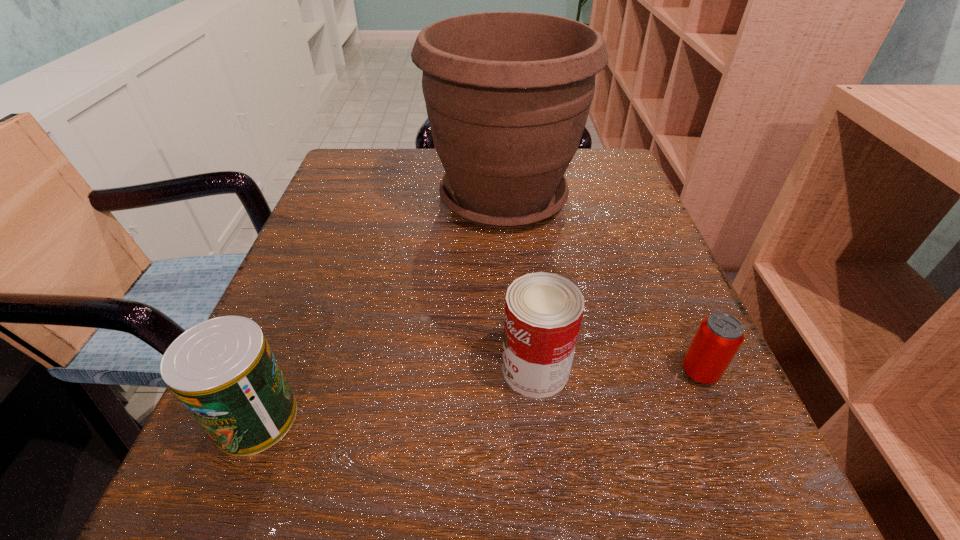
Locate an element on the screen. Image resolution: width=960 pixels, height=540 pixels. free region located 0.100m on the right of the leftmost can is located at coordinates (374, 418).

At what (x,y) coordinates should I click in order to perform the action: click on free point located on the left of the shortest object. Please return your answer as a coordinate pair (x, y). The height and width of the screenshot is (540, 960). Looking at the image, I should click on (536, 372).

Image resolution: width=960 pixels, height=540 pixels. I want to click on object that is positioned at the far edge, so click(507, 94).

Locate an element on the screen. The height and width of the screenshot is (540, 960). object present at the left edge is located at coordinates (223, 371).

Where is `flowerpot situated at the right edge`? Image resolution: width=960 pixels, height=540 pixels. flowerpot situated at the right edge is located at coordinates (507, 94).

The width and height of the screenshot is (960, 540). In order to click on can that is at the right edge in this screenshot , I will do `click(719, 336)`.

Locate an element on the screen. Image resolution: width=960 pixels, height=540 pixels. object that is at the far right corner is located at coordinates (507, 94).

Where is `free space at the far edge of the desktop`? free space at the far edge of the desktop is located at coordinates (426, 165).

Locate an element on the screen. The image size is (960, 540). vacant area at the left edge of the desktop is located at coordinates (281, 296).

This screenshot has width=960, height=540. What are the coordinates of `vacant space at the right edge of the desktop` in the screenshot? It's located at (612, 286).